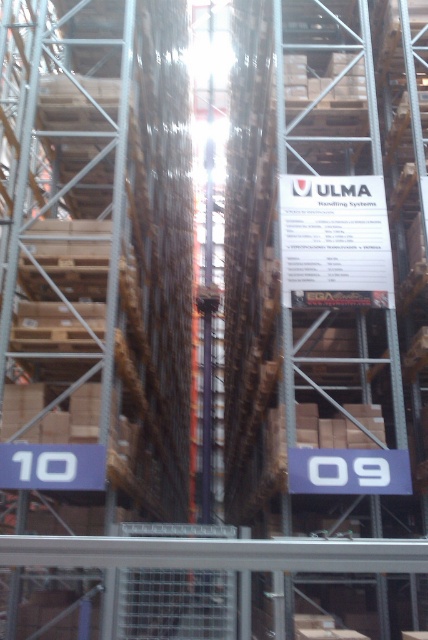
Question: Can you confirm if white paper sign at center is positioned to the left of white plastic sign at lower center?

Choices:
 (A) no
 (B) yes

Answer: (A)

Question: Observing the image, what is the correct spatial positioning of white paper sign at center in reference to white plastic sign at lower center?

Choices:
 (A) left
 (B) right

Answer: (B)

Question: Can you confirm if white paper sign at center is wider than white plastic sign at lower center?

Choices:
 (A) no
 (B) yes

Answer: (B)